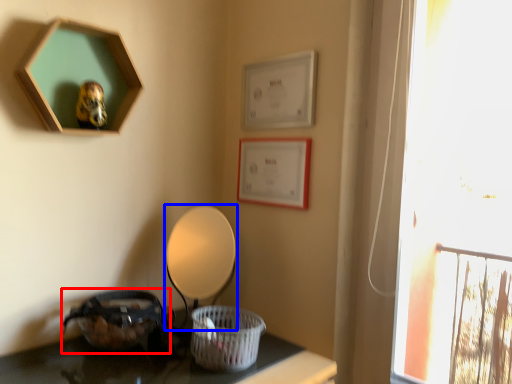
Question: Which object is further to the camera taking this photo, basket (highlighted by a red box) or table lamp (highlighted by a blue box)?

Choices:
 (A) basket
 (B) table lamp

Answer: (B)